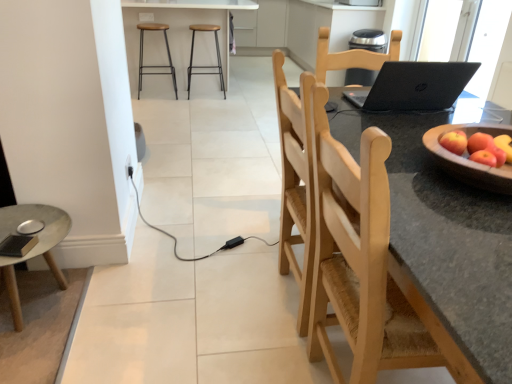
This screenshot has width=512, height=384. Describe the element at coordinates (205, 66) in the screenshot. I see `wooden stool at center, acting as the first stool starting from the right` at that location.

In order to face metallic black stool at upper left, marked as the second stool in a right-to-left arrangement, should I rotate leftwards or rightwards?

You should look left and rotate roughly 13.189 degrees.

I want to click on red matte apple at right, so click(x=479, y=147).

Measure the distance between red matte apple at right and camera.

The depth of red matte apple at right is 3.34 feet.

Measure the distance between point (484, 173) and camera.

Point (484, 173) is 3.30 feet from camera.

Identify the location of black matte laptop at center. (414, 86).

Is black plastic outlet at lower left directly adjacent to matte wooden desk at lower left?

black plastic outlet at lower left is not next to matte wooden desk at lower left, and they're not touching.

Is black plastic outlet at lower left spatially inside matte wooden desk at lower left, or outside of it?

The correct answer is: outside.

Is black plastic outlet at lower left aimed at matte wooden desk at lower left?

No, black plastic outlet at lower left does not turn towards matte wooden desk at lower left.

Is point (127, 170) in front of point (24, 218)?

That is False.

Is matte wooden desk at lower left at the back of wooden bowl at right?

That's not correct — wooden bowl at right is not looking away from matte wooden desk at lower left.

Based on the photo, are wooden bowl at right and matte wooden desk at lower left beside each other?

No, wooden bowl at right is not with matte wooden desk at lower left.

Which is less distant, (454, 167) or (27, 255)?

Point (454, 167).

Consider the image. Does wooden stool at center, acting as the first stool starting from the right, appear on the left side of red matte apple at right?

Yes, wooden stool at center, acting as the first stool starting from the right, is to the left of red matte apple at right.

Is wooden stool at center, acting as the first stool starting from the right, outside of red matte apple at right?

wooden stool at center, acting as the first stool starting from the right, lies outside red matte apple at right's area.

How much distance is there between wooden stool at center, which appears as the second stool when viewed from the left, and red matte apple at right?

wooden stool at center, which appears as the second stool when viewed from the left, and red matte apple at right are 3.82 meters apart.

In the image, is wooden stool at center, which appears as the second stool when viewed from the left, positioned in front of or behind red matte apple at right?

wooden stool at center, which appears as the second stool when viewed from the left, is behind red matte apple at right.

Is the position of metallic black stool at upper left, the 1th stool positioned from the left, more distant than that of black matte laptop at center?

Yes, metallic black stool at upper left, the 1th stool positioned from the left, is behind black matte laptop at center.

What's the angular difference between metallic black stool at upper left, the 1th stool positioned from the left, and black matte laptop at center's facing directions?

1.53 degrees.

Considering the relative positions of metallic black stool at upper left, the 1th stool positioned from the left, and black matte laptop at center in the image provided, is metallic black stool at upper left, the 1th stool positioned from the left, to the left of black matte laptop at center from the viewer's perspective?

Yes, metallic black stool at upper left, the 1th stool positioned from the left, is to the left of black matte laptop at center.

Which of these two, metallic black stool at upper left, the 1th stool positioned from the left, or black matte laptop at center, is bigger?

metallic black stool at upper left, the 1th stool positioned from the left, is bigger.

Can you tell me how much red matte apple at right and metallic black stool at upper left, marked as the second stool in a right-to-left arrangement, differ in facing direction?

The facing directions of red matte apple at right and metallic black stool at upper left, marked as the second stool in a right-to-left arrangement, are 10.1 degrees apart.

Considering the points (501, 157) and (141, 65), which point is in front, point (501, 157) or point (141, 65)?

The point (501, 157) is in front.

Considering the relative positions of red matte apple at right and metallic black stool at upper left, the 1th stool positioned from the left, in the image provided, is red matte apple at right to the left or to the right of metallic black stool at upper left, the 1th stool positioned from the left,?

From the image, it's evident that red matte apple at right is to the right of metallic black stool at upper left, the 1th stool positioned from the left.

Is red matte apple at right smaller than metallic black stool at upper left, marked as the second stool in a right-to-left arrangement?

Indeed, red matte apple at right has a smaller size compared to metallic black stool at upper left, marked as the second stool in a right-to-left arrangement.

From their relative heights in the image, would you say wooden stool at center, acting as the first stool starting from the right, is taller or shorter than black plastic outlet at lower left?

wooden stool at center, acting as the first stool starting from the right, is taller than black plastic outlet at lower left.

Looking at their sizes, would you say wooden stool at center, which appears as the second stool when viewed from the left, is wider or thinner than black plastic outlet at lower left?

Considering their sizes, wooden stool at center, which appears as the second stool when viewed from the left, looks broader than black plastic outlet at lower left.

Does point (208, 72) lie in front of point (130, 175)?

No, it is not.

From the image's perspective, does wooden stool at center, acting as the first stool starting from the right, appear lower than black plastic outlet at lower left?

Incorrect, from the image's perspective, wooden stool at center, acting as the first stool starting from the right, is higher than black plastic outlet at lower left.

Can we say red matte apple at right lies outside metallic silver barstools at upper center?

red matte apple at right is positioned outside metallic silver barstools at upper center.

Is red matte apple at right closer to camera compared to metallic silver barstools at upper center?

Yes, the depth of red matte apple at right is less than that of metallic silver barstools at upper center.

Which of these two, red matte apple at right or metallic silver barstools at upper center, is bigger?

metallic silver barstools at upper center is bigger.

The image size is (512, 384). Find the location of `desk below the black plastic outlet at lower left (from the image's perspective)`. desk below the black plastic outlet at lower left (from the image's perspective) is located at coordinates (33, 247).

At what (x,y) coordinates should I click in order to perform the action: click on bowl located on the right of matte wooden desk at lower left. Please return your answer as a coordinate pair (x, y). The height and width of the screenshot is (384, 512). Looking at the image, I should click on (468, 160).

When comparing their distances from wooden chair at center, does matte wooden desk at lower left or black plastic outlet at lower left seem closer?

matte wooden desk at lower left is closer to wooden chair at center.

Looking at the image, which one is located closer to black matte laptop at center, black plastic outlet at lower left or matte wooden desk at lower left?

Among the two, matte wooden desk at lower left is located nearer to black matte laptop at center.

Considering their positions, is wooden stool at center, which appears as the second stool when viewed from the left, positioned closer to wooden bowl at right than black matte laptop at center?

Among the two, black matte laptop at center is located nearer to wooden bowl at right.

Based on their spatial positions, is black plastic outlet at lower left or metallic silver barstools at upper center closer to red matte apple at right?

The object closer to red matte apple at right is black plastic outlet at lower left.

From the image, which object appears to be nearer to metallic black stool at upper left, marked as the second stool in a right-to-left arrangement, red matte apple at right or wooden stool at center, which appears as the second stool when viewed from the left?

wooden stool at center, which appears as the second stool when viewed from the left, is closer to metallic black stool at upper left, marked as the second stool in a right-to-left arrangement.

Estimate the real-world distances between objects in this image. Which object is further from wooden chair at center, matte wooden desk at lower left or black matte laptop at center?

The object further to wooden chair at center is matte wooden desk at lower left.

Based on their spatial positions, is black matte laptop at center or wooden stool at center, acting as the first stool starting from the right, further from wooden chair at center?

The object further to wooden chair at center is wooden stool at center, acting as the first stool starting from the right.

Looking at the image, which one is located further to black matte laptop at center, wooden stool at center, which appears as the second stool when viewed from the left, or wooden chair at center?

wooden stool at center, which appears as the second stool when viewed from the left.

Locate an element on the screen. desk between red matte apple at right and metallic silver barstools at upper center in the front-back direction is located at coordinates (33, 247).

Find the location of a particular element. bowl positioned between wooden chair at center and black plastic outlet at lower left from near to far is located at coordinates (468, 160).

The height and width of the screenshot is (384, 512). Identify the location of electric outlet located between matte wooden desk at lower left and red matte apple at right in the left-right direction. click(x=129, y=167).

The height and width of the screenshot is (384, 512). What are the coordinates of `desk located between red matte apple at right and metallic black stool at upper left, the 1th stool positioned from the left, in the depth direction` in the screenshot? It's located at (33, 247).